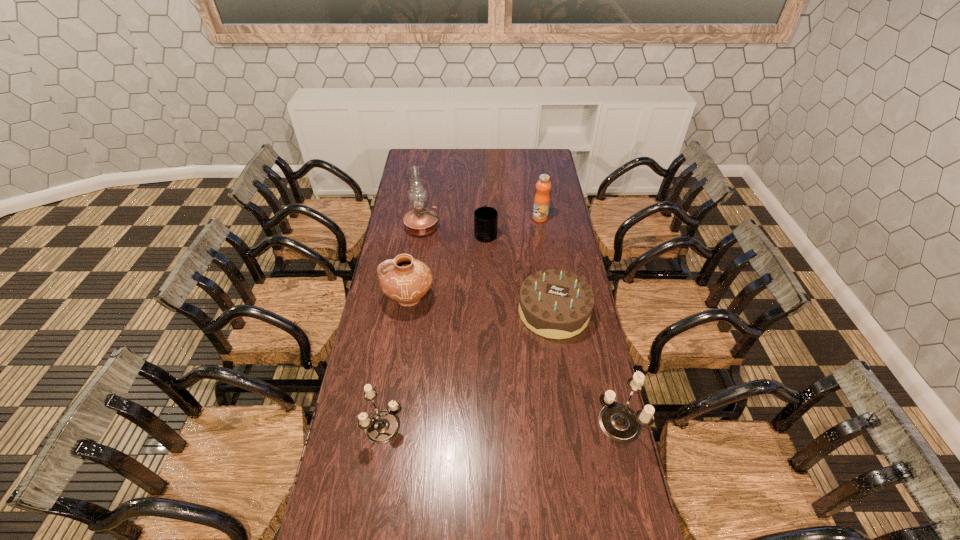
Where is `free location located on the front of the fruit juice`? free location located on the front of the fruit juice is located at coordinates (548, 268).

The width and height of the screenshot is (960, 540). I want to click on free spot located 0.140m on the side of the fourth object from right to left with the handle, so tap(486, 207).

You are a GUI agent. You are given a task and a screenshot of the screen. Output one action in this format:
    pyautogui.click(x=<x>, y=<y>)
    Task: Click on the vacant space located on the side of the fourth object from right to left with the handle
    The width and height of the screenshot is (960, 540).
    Given the screenshot: What is the action you would take?
    pyautogui.click(x=486, y=214)

This screenshot has height=540, width=960. Identify the location of free space located 0.160m on the side of the fourth object from right to left with the handle. (485, 205).

The height and width of the screenshot is (540, 960). I want to click on free point located 0.350m on the front-facing side of the birthday cake, so click(571, 426).

At what (x,y) coordinates should I click in order to perform the action: click on candle holder that is positioned at the left edge. Please return your answer as a coordinate pair (x, y). This screenshot has height=540, width=960. Looking at the image, I should click on (382, 426).

Identify the location of oil lamp at the left edge. (420, 221).

I want to click on pottery located in the left edge section of the desktop, so click(406, 280).

Find the location of a particular element. Image resolution: width=960 pixels, height=540 pixels. candle holder present at the right edge is located at coordinates (618, 422).

Locate an element on the screen. The width and height of the screenshot is (960, 540). fruit juice at the right edge is located at coordinates (542, 198).